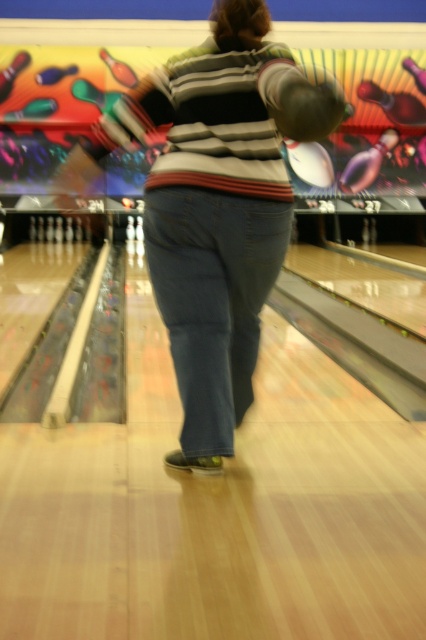
You are a fashion designer observing a person wearing a striped sweater at center and denim at center. Which item of clothing appears bigger on the person?

The striped sweater at center has a larger size compared to denim at center, so the striped sweater at center appears bigger on the person.

Where is the striped sweater at center located in the image?

The striped sweater at center is located at point (219, 208) in the image.